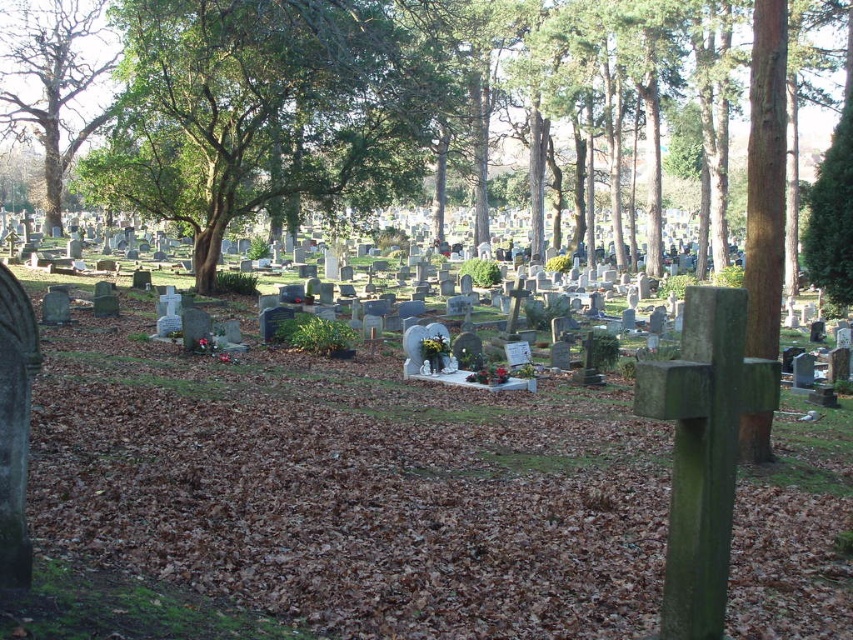
You are standing at the entrance of the cemetery and see the point marked as point (x=351, y=486). What object is located at that point?

The point (x=351, y=486) corresponds to the smooth stone cross at center.

Consider the image. You are standing at the entrance of the cemetery and want to take a photo of the smooth stone cross at center without the green leafy tree at upper left appearing in the background. Is this possible based on their positions?

The smooth stone cross at center is in front of the green leafy tree at upper left, so if you position yourself so that the cross is between you and the tree, the tree will still be visible behind the cross. To exclude the tree, you would need to angle the camera or move to a position where the cross blocks the tree entirely, but given their spatial relationship, this might not be feasible without moving further away or adjusting your angle significantly.

Looking at this image, you are standing in a cemetery and want to place a bouquet of flowers at the smooth stone cross at center. If you are currently 10 feet away from the cross, how many more feet do you need to walk to reach it?

The smooth stone cross at center is 17.23 feet from the viewer. Since you are already 10 feet away, you need to walk an additional 7.23 feet to reach it.